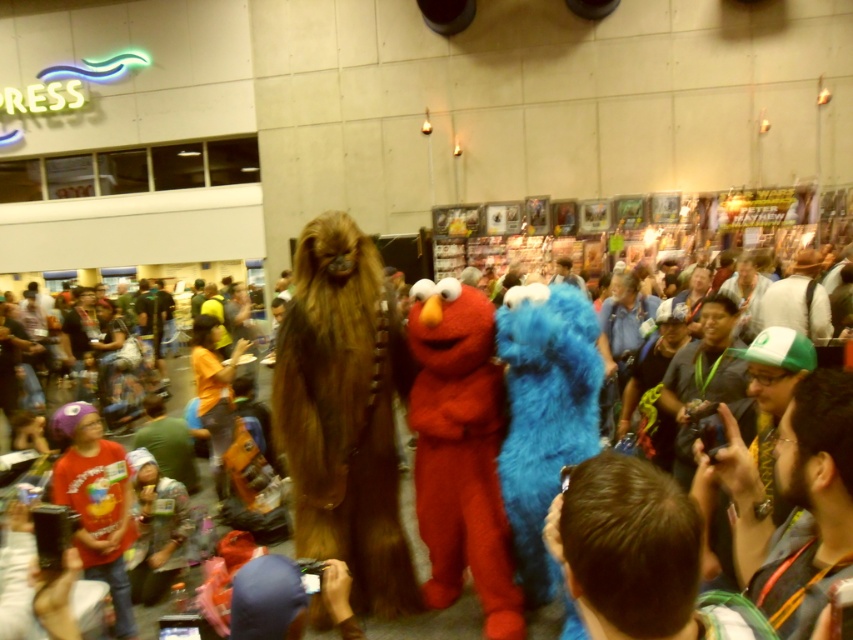
In the convention scene, there are three costumed characters in the foreground. The first is a Chewbacca costume on the left, followed by an Elmo costume in the center, and a third character on the right. A blue furry animal is marked at point (x=544, y=412). Which costumed character is located at the specified point?

The blue furry animal at center is the character located at point (x=544, y=412).